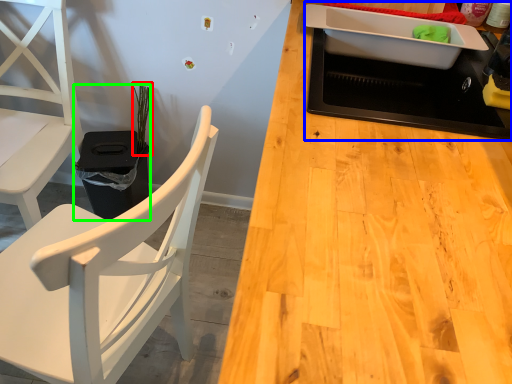
Question: Considering the real-world distances, which object is closest to plant (highlighted by a red box)? appliance (highlighted by a blue box) or houseplant (highlighted by a green box).

Choices:
 (A) appliance
 (B) houseplant

Answer: (B)